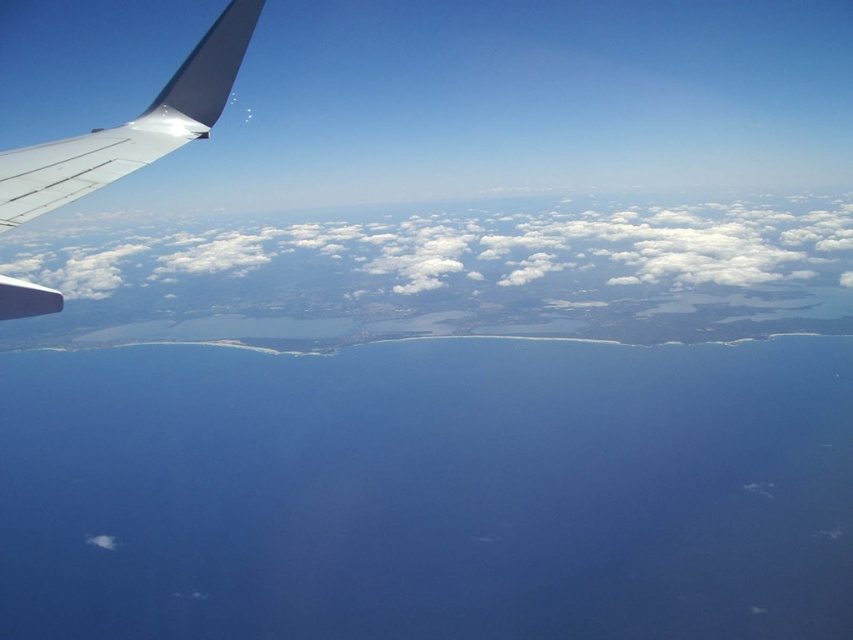
Question: Observing the image, what is the correct spatial positioning of blue water at center in reference to white fluffy cloud at center?

Choices:
 (A) right
 (B) left

Answer: (A)

Question: Is blue water at center further to camera compared to white fluffy cloud at center?

Choices:
 (A) no
 (B) yes

Answer: (A)

Question: Can you confirm if white fluffy cloud at center is thinner than metallic gray wing at upper left?

Choices:
 (A) yes
 (B) no

Answer: (B)

Question: Which object appears closest to the camera in this image?

Choices:
 (A) white fluffy cloud at center
 (B) metallic gray wing at upper left
 (C) blue water at center

Answer: (B)

Question: Which point is farther to the camera?

Choices:
 (A) (230, 262)
 (B) (717, 566)
 (C) (86, 188)

Answer: (A)

Question: Among these points, which one is nearest to the camera?

Choices:
 (A) (347, 412)
 (B) (9, 209)

Answer: (B)